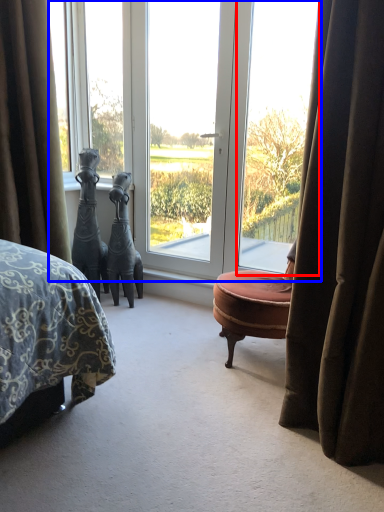
Question: Which object appears farthest to the camera in this image, window (highlighted by a red box) or window (highlighted by a blue box)?

Choices:
 (A) window
 (B) window

Answer: (B)